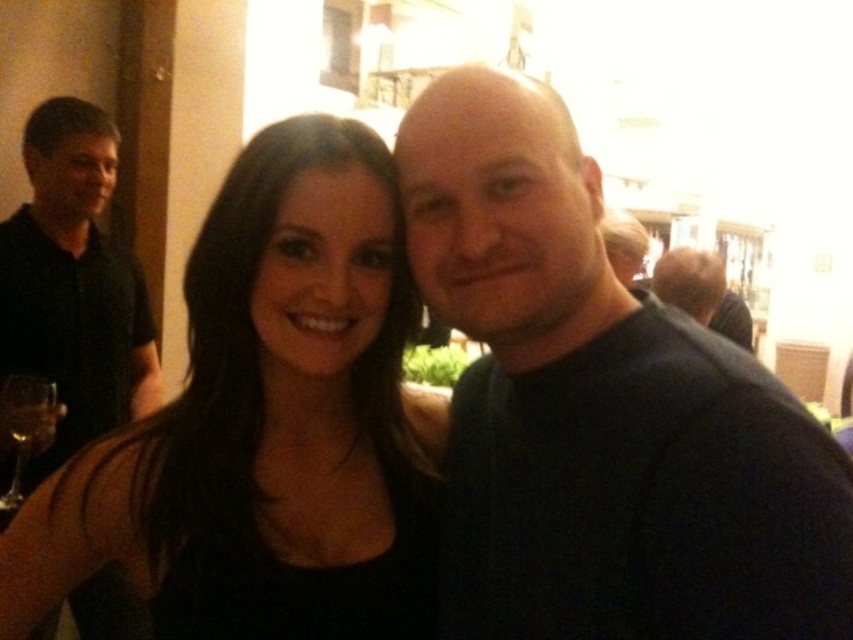
You are at a party and want to place a small gift on the table between the black matte dress at center and the transparent glass wine glass at lower left. Which object should you place the gift closer to if you want it near the dress?

You should place the gift closer to the black matte dress at center because it is to the right of the transparent glass wine glass at lower left, meaning the dress is farther from the glass. Therefore, placing the gift near the dress would require positioning it closer to the dress itself.

You are a photographer at a social event and need to decide if a wide angle lens is necessary to capture both the dark blue shirt at center and the black matte dress at center in the same frame. Based on their sizes, would you need a wide angle lens?

The dark blue shirt at center has a lesser width compared to the black matte dress at center. Since the black matte dress at center is wider, it might require a wider angle to ensure both fit in the frame, so a wide angle lens would be advisable.

You are a photographer at the event and want to focus your camera on the dark blue shirt at center without blurring the black matte dress at center. Is this possible given their positions?

The dark blue shirt at center is closer to the viewer than the black matte dress at center, so focusing on the dark blue shirt at center may cause the black matte dress at center to be out of focus unless using a wide depth of field.